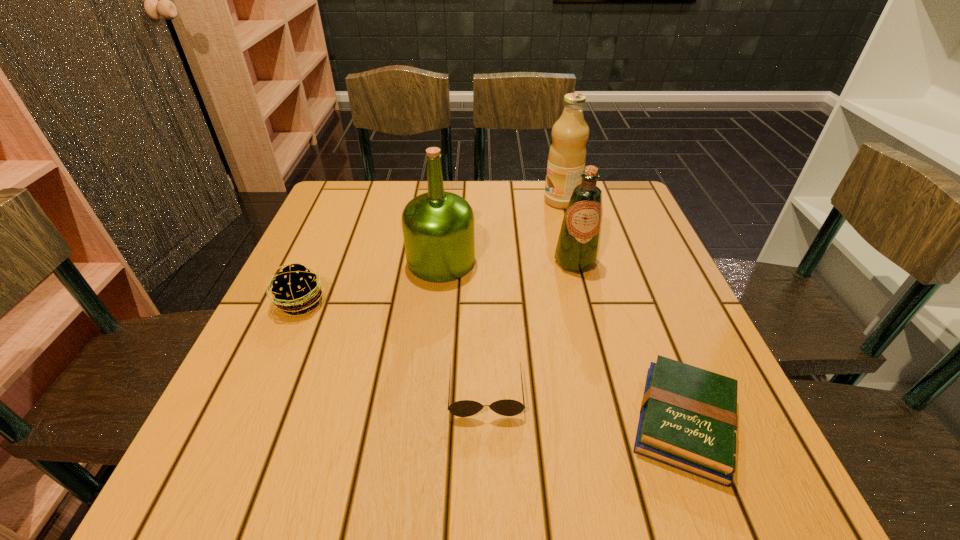
You are a GUI agent. You are given a task and a screenshot of the screen. Output one action in this format:
    pyautogui.click(x=<x>, y=<y>)
    Task: Click on the farthest object
    This screenshot has width=960, height=540.
    Given the screenshot: What is the action you would take?
    pyautogui.click(x=567, y=155)

Identify the location of the leftmost olive oil. This screenshot has height=540, width=960. (438, 227).

At what (x,y) coordinates should I click in order to perform the action: click on the fourth shortest object. Please return your answer as a coordinate pair (x, y). The height and width of the screenshot is (540, 960). Looking at the image, I should click on (577, 249).

This screenshot has width=960, height=540. Find the location of `patty`. patty is located at coordinates (295, 288).

I want to click on the third shortest object, so click(295, 288).

Locate an element on the screen. sunglasses is located at coordinates (506, 407).

Identify the location of book. (688, 417).

Where is `vacant space located 0.110m on the label of the farthest object`? This screenshot has height=540, width=960. vacant space located 0.110m on the label of the farthest object is located at coordinates (504, 201).

This screenshot has width=960, height=540. Find the location of `vacant region located 0.360m on the label of the farthest object`. vacant region located 0.360m on the label of the farthest object is located at coordinates (413, 201).

This screenshot has width=960, height=540. I want to click on vacant space located on the label of the farthest object, so click(x=468, y=201).